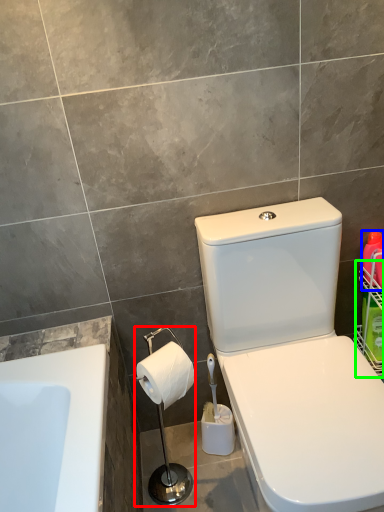
Question: Estimate the real-world distances between objects in this image. Which object is closer to shower (highlighted by a red box), cleaning product (highlighted by a blue box) or basket (highlighted by a green box)?

Choices:
 (A) cleaning product
 (B) basket

Answer: (B)